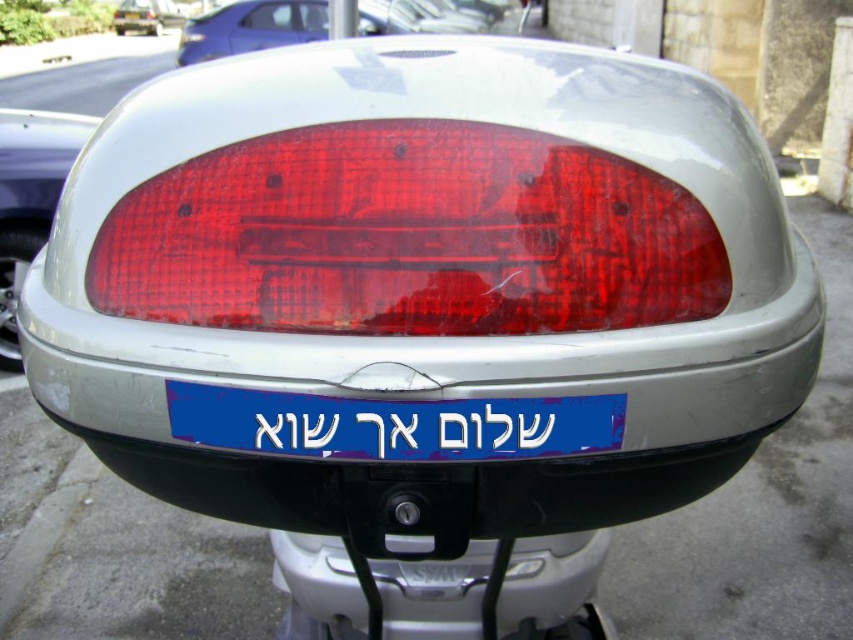
You are a pedestrian standing behind the scooter. You notice the transparent red tail light at center and the metallic silver bumper at lower center. Which object is located higher up?

The transparent red tail light at center is positioned over the metallic silver bumper at lower center, so it is higher up.

You are a mechanic inspecting the scooter. You notice the matte plastic tail light at left and the matte red taillight at upper center. Which one is located to the right of the other?

The matte plastic tail light at left is positioned on the right side of the matte red taillight at upper center, so it is to the right of the matte red taillight at upper center.